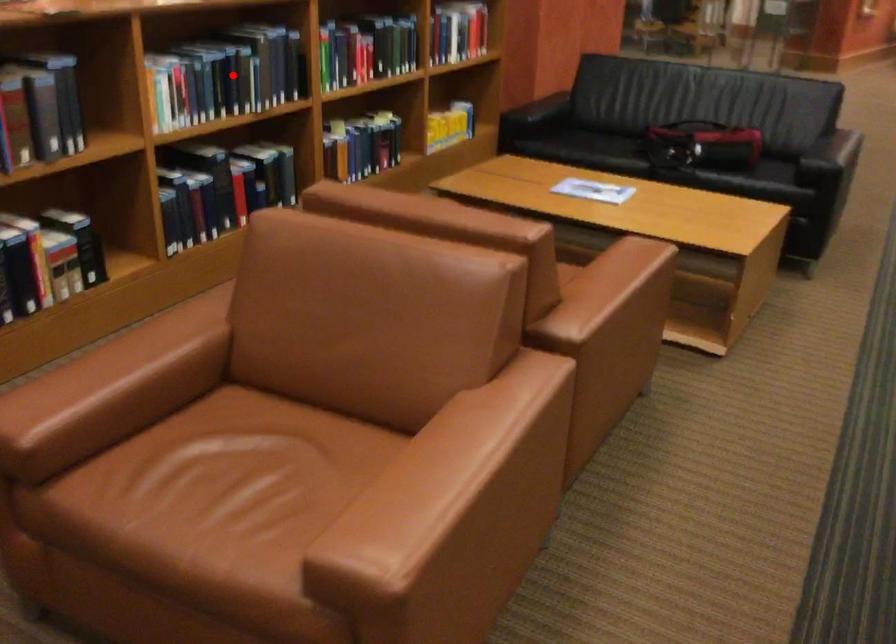
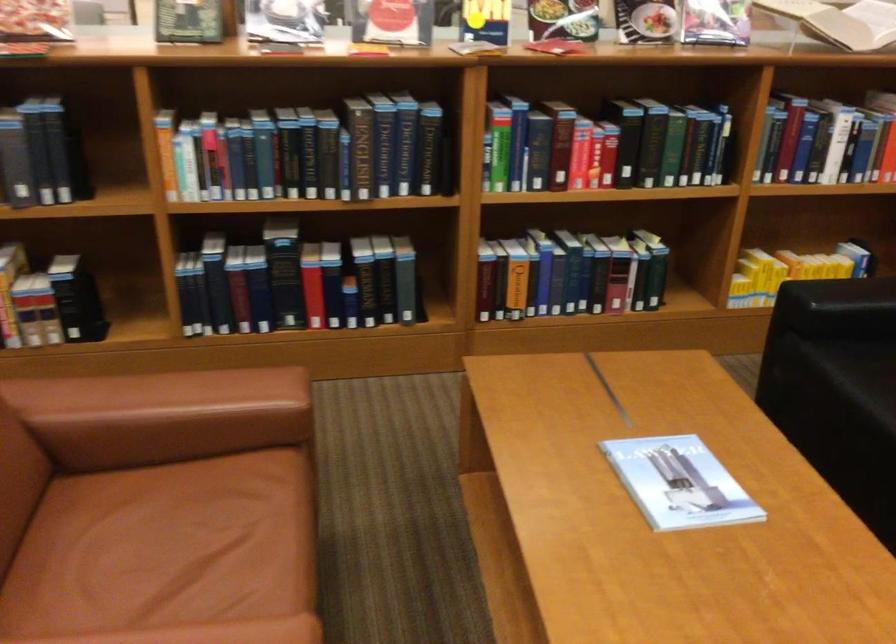
Question: A red point is marked in image1. In image2, is the corresponding 3D point closer to the camera or farther? Reply with the corresponding letter.

Choices:
 (A) The corresponding 3D point is closer.
 (B) The corresponding 3D point is farther.

Answer: (A)